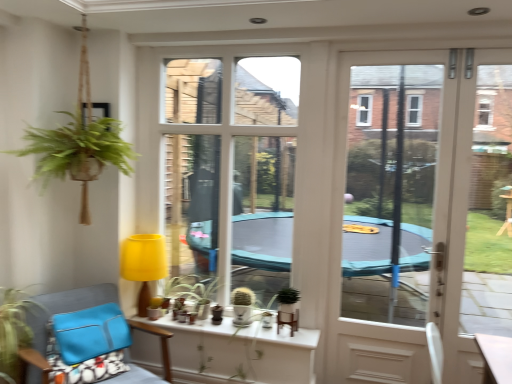
This screenshot has height=384, width=512. I want to click on vacant space situated on the left part of matte white cactus at center, which is the 2th houseplant in front-to-back order, so click(x=214, y=321).